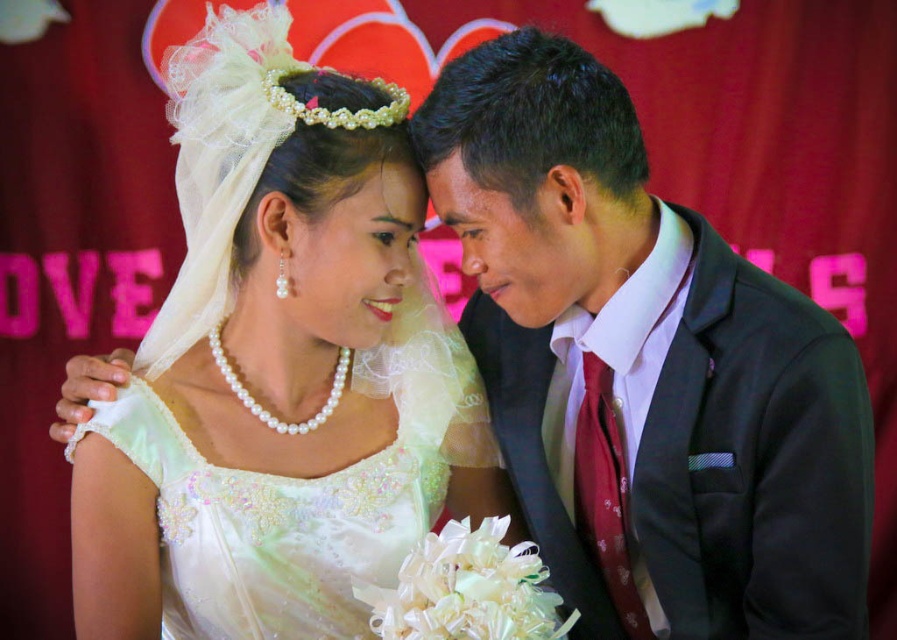
Question: Which point is closer to the camera?

Choices:
 (A) satin black suit at right
 (B) white satin dress at center

Answer: (A)

Question: Does white satin dress at center have a smaller size compared to satin black suit at right?

Choices:
 (A) no
 (B) yes

Answer: (B)

Question: Can you confirm if white satin dress at center is positioned to the left of satin black suit at right?

Choices:
 (A) yes
 (B) no

Answer: (A)

Question: Is white satin dress at center below satin black suit at right?

Choices:
 (A) no
 (B) yes

Answer: (A)